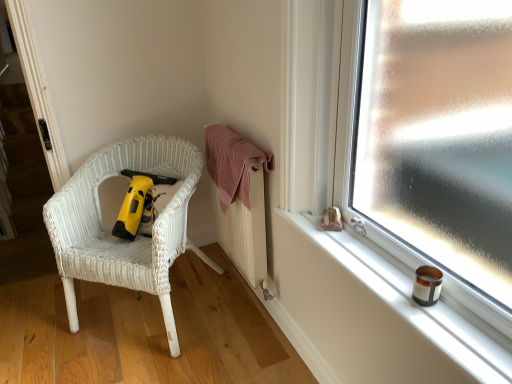
The width and height of the screenshot is (512, 384). Describe the element at coordinates (232, 163) in the screenshot. I see `pink cotton towel at center` at that location.

What do you see at coordinates (139, 204) in the screenshot? I see `yellow plastic vacuum at left` at bounding box center [139, 204].

Describe the element at coordinates (405, 302) in the screenshot. The image size is (512, 384). I see `smooth white window sill at right` at that location.

Identify the location of pink cotton towel at center. The width and height of the screenshot is (512, 384). (232, 163).

This screenshot has height=384, width=512. What are the coordinates of `window sill that appears on the right of yellow plastic vacuum at left` in the screenshot? It's located at (405, 302).

Considering the relative positions of yellow plastic vacuum at left and smooth white window sill at right in the image provided, is yellow plastic vacuum at left to the right of smooth white window sill at right from the viewer's perspective?

No.

Based on the photo, is yellow plastic vacuum at left oriented away from smooth white window sill at right?

No, smooth white window sill at right is not at the back of yellow plastic vacuum at left.

Would you say white wicker chair at left is a long distance from yellow plastic vacuum at left?

They are positioned close to each other.

Considering their positions, is white wicker chair at left located in front of or behind yellow plastic vacuum at left?

In the image, white wicker chair at left appears in front of yellow plastic vacuum at left.

Which is behind, point (172, 339) or point (131, 206)?

The point (131, 206) is behind.

From the image's perspective, which one is positioned lower, yellow plastic vacuum at left or white wicker chair at left?

white wicker chair at left.

Which is correct: yellow plastic vacuum at left is inside white wicker chair at left, or outside of it?

yellow plastic vacuum at left lies within the bounds of white wicker chair at left.

From their relative heights in the image, would you say yellow plastic vacuum at left is taller or shorter than white wicker chair at left?

Result: Considering their sizes, yellow plastic vacuum at left has less height than white wicker chair at left.

Can you tell me how much yellow plastic vacuum at left and white wicker chair at left differ in facing direction?

The angular difference between yellow plastic vacuum at left and white wicker chair at left is 3.72 degrees.

Can you confirm if smooth white window sill at right is wider than yellow plastic vacuum at left?

No.

Which is behind, smooth white window sill at right or yellow plastic vacuum at left?

yellow plastic vacuum at left is behind.

Can you confirm if smooth white window sill at right is bigger than yellow plastic vacuum at left?

Actually, smooth white window sill at right might be smaller than yellow plastic vacuum at left.

Is smooth white window sill at right facing away from yellow plastic vacuum at left?

No, yellow plastic vacuum at left is not at the back of smooth white window sill at right.

How far apart are yellow plastic vacuum at left and pink cotton towel at center?

The distance of yellow plastic vacuum at left from pink cotton towel at center is 14.18 inches.

From the image's perspective, is yellow plastic vacuum at left located above pink cotton towel at center?

Answer: Actually, yellow plastic vacuum at left appears below pink cotton towel at center in the image.

Which point is more distant from viewer, (128, 202) or (246, 207)?

The point (128, 202) is more distant.

Considering the positions of objects yellow plastic vacuum at left and pink cotton towel at center in the image provided, who is more to the right, yellow plastic vacuum at left or pink cotton towel at center?

pink cotton towel at center.

Are pink cotton towel at center and yellow plastic vacuum at left far apart?

That's not correct — pink cotton towel at center is a little close to yellow plastic vacuum at left.

From a real-world perspective, does pink cotton towel at center sit lower than yellow plastic vacuum at left?

Incorrect, from a real-world perspective, pink cotton towel at center is higher than yellow plastic vacuum at left.

Identify the location of vacuum that is under the pink cotton towel at center (from a real-world perspective). Image resolution: width=512 pixels, height=384 pixels. (139, 204).

From the image's perspective, between white wicker chair at left and pink cotton towel at center, which one is located above?

pink cotton towel at center.

Does point (97, 203) come behind point (270, 170)?

Yes.

Between white wicker chair at left and pink cotton towel at center, which one has larger size?

With larger size is white wicker chair at left.

Where is `window sill in front of the yellow plastic vacuum at left`? window sill in front of the yellow plastic vacuum at left is located at coordinates (405, 302).

I want to click on vacuum behind the white wicker chair at left, so click(x=139, y=204).

When comparing their distances from smooth white window sill at right, does pink cotton towel at center or yellow plastic vacuum at left seem further?

yellow plastic vacuum at left.

Considering their positions, is white wicker chair at left positioned further to pink cotton towel at center than smooth white window sill at right?

smooth white window sill at right.

When comparing their distances from yellow plastic vacuum at left, does white wicker chair at left or smooth white window sill at right seem closer?

white wicker chair at left lies closer to yellow plastic vacuum at left than the other object.

Which object lies further to the anchor point white wicker chair at left, yellow plastic vacuum at left or smooth white window sill at right?

Based on the image, smooth white window sill at right appears to be further to white wicker chair at left.

Which object lies further to the anchor point smooth white window sill at right, yellow plastic vacuum at left or white wicker chair at left?

yellow plastic vacuum at left is positioned further to the anchor smooth white window sill at right.

From the image, which object appears to be farther from white wicker chair at left, pink cotton towel at center or smooth white window sill at right?

The object further to white wicker chair at left is smooth white window sill at right.

Looking at the image, which one is located closer to white wicker chair at left, pink cotton towel at center or yellow plastic vacuum at left?

yellow plastic vacuum at left is positioned closer to the anchor white wicker chair at left.

Considering their positions, is smooth white window sill at right positioned closer to white wicker chair at left than yellow plastic vacuum at left?

yellow plastic vacuum at left is positioned closer to the anchor white wicker chair at left.

Locate an element on the screen. vacuum between white wicker chair at left and pink cotton towel at center from left to right is located at coordinates (139, 204).

Where is `clothe between white wicker chair at left and smooth white window sill at right`? This screenshot has width=512, height=384. clothe between white wicker chair at left and smooth white window sill at right is located at coordinates (232, 163).

Find the location of a particular element. The image size is (512, 384). chair between smooth white window sill at right and yellow plastic vacuum at left from front to back is located at coordinates (120, 239).

You are a GUI agent. You are given a task and a screenshot of the screen. Output one action in this format:
    pyautogui.click(x=<x>, y=<y>)
    Task: Click on the clothe between smooth white window sill at right and yellow plastic vacuum at left along the z-axis
    The image size is (512, 384).
    Given the screenshot: What is the action you would take?
    pyautogui.click(x=232, y=163)